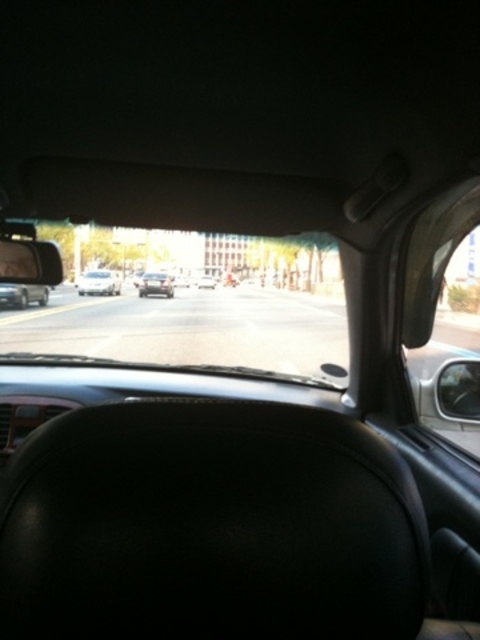
Can you confirm if transparent glass car window at right is bigger than black glossy sedan at center?

Correct, transparent glass car window at right is larger in size than black glossy sedan at center.

Is point (437, 401) positioned in front of point (201, 278)?

Yes.

Locate an element on the screen. transparent glass car window at right is located at coordinates (442, 264).

Where is `transparent glass car window at right`? The image size is (480, 640). transparent glass car window at right is located at coordinates (442, 264).

Is transparent glass windshield at center below silver metallic sedan at center?

No, transparent glass windshield at center is not below silver metallic sedan at center.

Is transparent glass windshield at center in front of silver metallic sedan at center?

That is True.

Which is behind, point (214, 360) or point (83, 282)?

Point (83, 282)

At what (x,y) coordinates should I click in order to perform the action: click on transparent glass windshield at center. Please return your answer as a coordinate pair (x, y). The width and height of the screenshot is (480, 640). Looking at the image, I should click on (191, 301).

Does matte black car at left lie in front of black glossy sedan at center?

Yes, it is in front of black glossy sedan at center.

Which is below, matte black car at left or black glossy sedan at center?

matte black car at left is below.

Who is more forward, [29,291] or [210,282]?

Positioned in front is point [29,291].

Find the location of `matte black car at left`. matte black car at left is located at coordinates (23, 294).